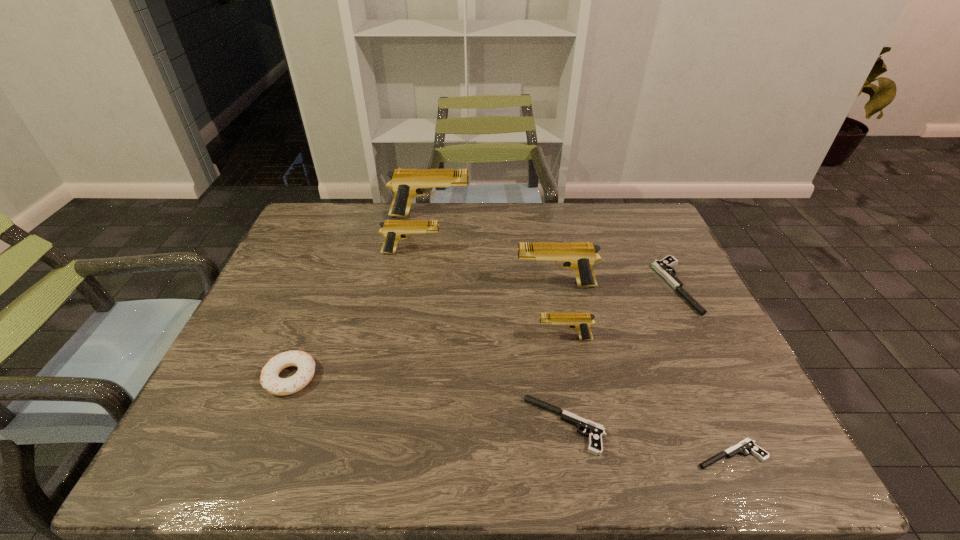
Find the location of a particular element. Image resolution: width=960 pixels, height=540 pixels. vacant point located between the doughnut and the farthest object is located at coordinates (360, 296).

The width and height of the screenshot is (960, 540). I want to click on empty location between the third shortest object and the smallest black pistol, so click(x=703, y=370).

What are the coordinates of `blank region between the sixth shortest pistol and the sixth nearest pistol` in the screenshot? It's located at pos(484,269).

Point out which object is positioned as the fourth nearest to the farthest object. Please provide its 2D coordinates. Your answer should be formatted as a tuple, i.e. [(x, y)], where the tuple contains the x and y coordinates of a point satisfying the conditions above.

[(663, 267)]

Point out which object is positioned as the second nearest to the farthest black pistol. Please provide its 2D coordinates. Your answer should be formatted as a tuple, i.e. [(x, y)], where the tuple contains the x and y coordinates of a point satisfying the conditions above.

[(581, 322)]

Image resolution: width=960 pixels, height=540 pixels. Identify the location of the closest pistol relative to the fourth tallest pistol. (596, 431).

Point out which pistol is positioned as the second nearest to the biggest tan pistol. Please provide its 2D coordinates. Your answer should be formatted as a tuple, i.e. [(x, y)], where the tuple contains the x and y coordinates of a point satisfying the conditions above.

[(579, 256)]

Point out which tan pistol is positioned as the third nearest to the third smallest tan pistol. Please provide its 2D coordinates. Your answer should be formatted as a tuple, i.e. [(x, y)], where the tuple contains the x and y coordinates of a point satisfying the conditions above.

[(406, 183)]

Find the location of a particular element. tan pistol that is the closest to the shortest pistol is located at coordinates (581, 322).

Identify the location of black pistol that is the second closest one to the fifth tallest object. The height and width of the screenshot is (540, 960). (747, 444).